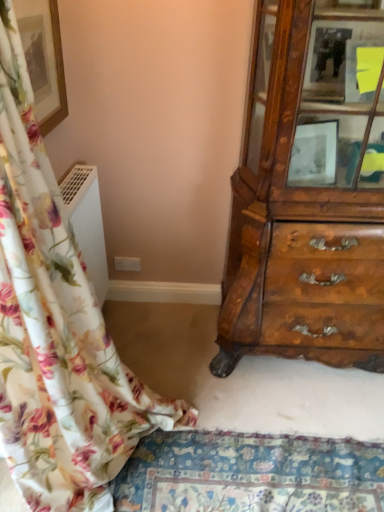
Question: Are floral fabric curtain at left and wooden cabinet at right beside each other?

Choices:
 (A) yes
 (B) no

Answer: (B)

Question: Considering the relative sizes of floral fabric curtain at left and wooden cabinet at right in the image provided, is floral fabric curtain at left thinner than wooden cabinet at right?

Choices:
 (A) no
 (B) yes

Answer: (A)

Question: Would you say wooden cabinet at right is part of floral fabric curtain at left's contents?

Choices:
 (A) no
 (B) yes

Answer: (A)

Question: Considering the relative sizes of floral fabric curtain at left and wooden cabinet at right in the image provided, is floral fabric curtain at left bigger than wooden cabinet at right?

Choices:
 (A) yes
 (B) no

Answer: (B)

Question: From a real-world perspective, is floral fabric curtain at left on top of wooden cabinet at right?

Choices:
 (A) no
 (B) yes

Answer: (A)

Question: Is floral fabric curtain at left positioned in front of wooden cabinet at right?

Choices:
 (A) no
 (B) yes

Answer: (B)

Question: Does floral fabric mat at lower center appear on the left side of floral fabric curtain at left?

Choices:
 (A) no
 (B) yes

Answer: (A)

Question: Considering the relative sizes of floral fabric mat at lower center and floral fabric curtain at left in the image provided, is floral fabric mat at lower center wider than floral fabric curtain at left?

Choices:
 (A) no
 (B) yes

Answer: (B)

Question: Is floral fabric mat at lower center closer to camera compared to floral fabric curtain at left?

Choices:
 (A) yes
 (B) no

Answer: (B)

Question: From a real-world perspective, is floral fabric mat at lower center beneath floral fabric curtain at left?

Choices:
 (A) no
 (B) yes

Answer: (B)

Question: Are floral fabric mat at lower center and floral fabric curtain at left far apart?

Choices:
 (A) yes
 (B) no

Answer: (B)

Question: Is floral fabric mat at lower center oriented away from floral fabric curtain at left?

Choices:
 (A) yes
 (B) no

Answer: (A)

Question: From a real-world perspective, is wooden cabinet at right on top of floral fabric curtain at left?

Choices:
 (A) yes
 (B) no

Answer: (A)